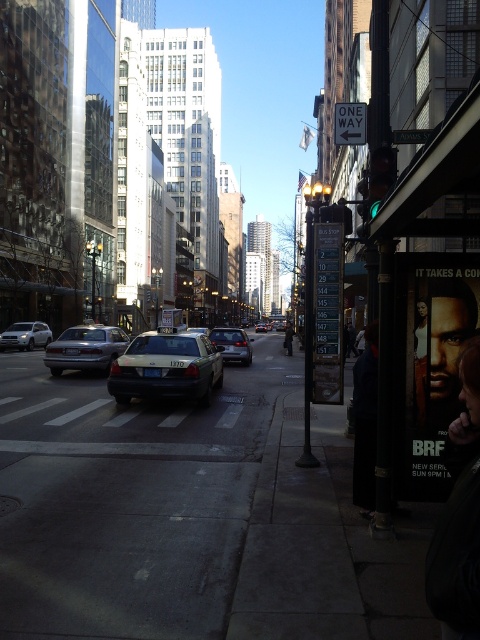
You are a pedestrian standing at the intersection and want to cross the street to reach the park located behind the buildings. The silver metallic sedan at left is blocking your path. Can you safely walk around it to continue your journey?

The silver metallic sedan at left is 36.83 meters away from you, which is a considerable distance. Since it is blocking your path, you can safely walk around it to reach the park behind the buildings.

You are driving a matte silver sedan at center and need to park it on the gray asphalt at center. Based on the scene description, can you safely park the sedan on the asphalt without crossing the ONE WAY sign? Please explain your reasoning.

The gray asphalt at center is positioned on the left side of the matte silver sedan at center. Since the ONE WAY sign points to the left, parking the matte silver sedan at center on the gray asphalt at center would require moving leftward, which aligns with the traffic direction indicated by the sign. Therefore, it is safe to park there without crossing the ONE WAY sign.